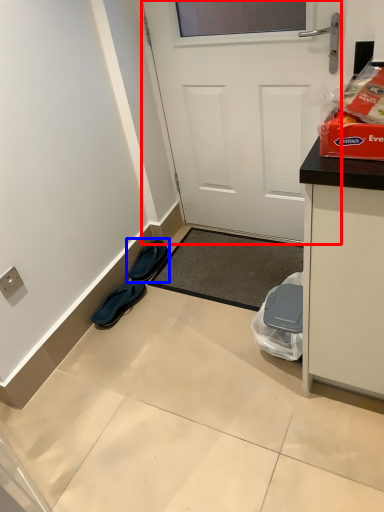
Question: Which object is closer to the camera taking this photo, door (highlighted by a red box) or footwear (highlighted by a blue box)?

Choices:
 (A) door
 (B) footwear

Answer: (A)